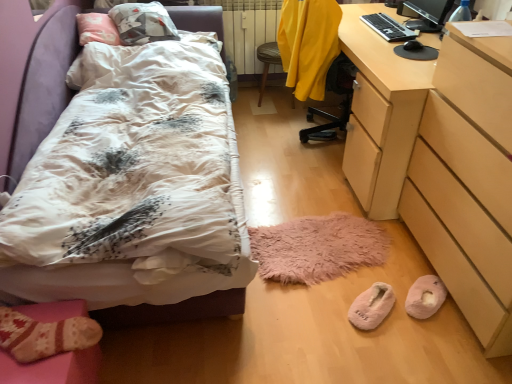
Image resolution: width=512 pixels, height=384 pixels. I want to click on vacant area that is situated to the right of black plastic keyboard at upper right, so click(415, 20).